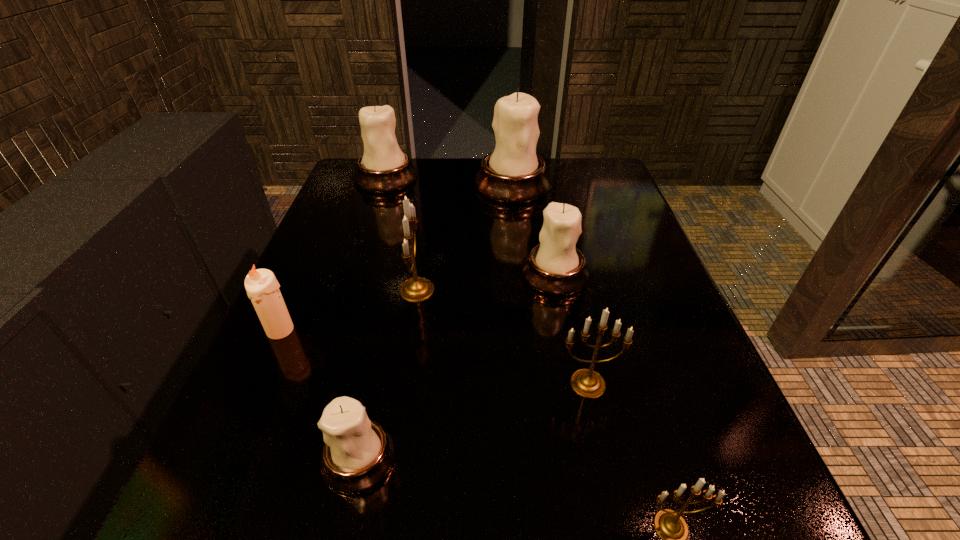
In order to click on the smallest white candle holder in this screenshot , I will do `click(358, 453)`.

Where is `vacant space located on the front of the biggest white candle holder`? Image resolution: width=960 pixels, height=540 pixels. vacant space located on the front of the biggest white candle holder is located at coordinates (520, 255).

What are the coordinates of `vacant space located 0.190m on the front of the second biggest white candle holder` in the screenshot? It's located at (366, 238).

Find the location of a particular element. Image resolution: width=960 pixels, height=540 pixels. vacant space situated 0.050m on the right of the farthest gold candelabrum is located at coordinates (460, 290).

Where is `free region located on the left of the second nearest white candle holder`? The width and height of the screenshot is (960, 540). free region located on the left of the second nearest white candle holder is located at coordinates (359, 274).

What are the coordinates of `vacant space located 0.290m on the back of the second nearest gold candelabrum` in the screenshot? It's located at (561, 258).

Where is `vacant region located 0.090m on the right of the fifth farthest object`? The width and height of the screenshot is (960, 540). vacant region located 0.090m on the right of the fifth farthest object is located at coordinates (346, 330).

Locate an element on the screen. object that is positioned at the near edge is located at coordinates (358, 453).

Where is `candle that is at the left edge`? This screenshot has width=960, height=540. candle that is at the left edge is located at coordinates (262, 287).

This screenshot has height=540, width=960. I want to click on object that is at the far left corner, so click(383, 168).